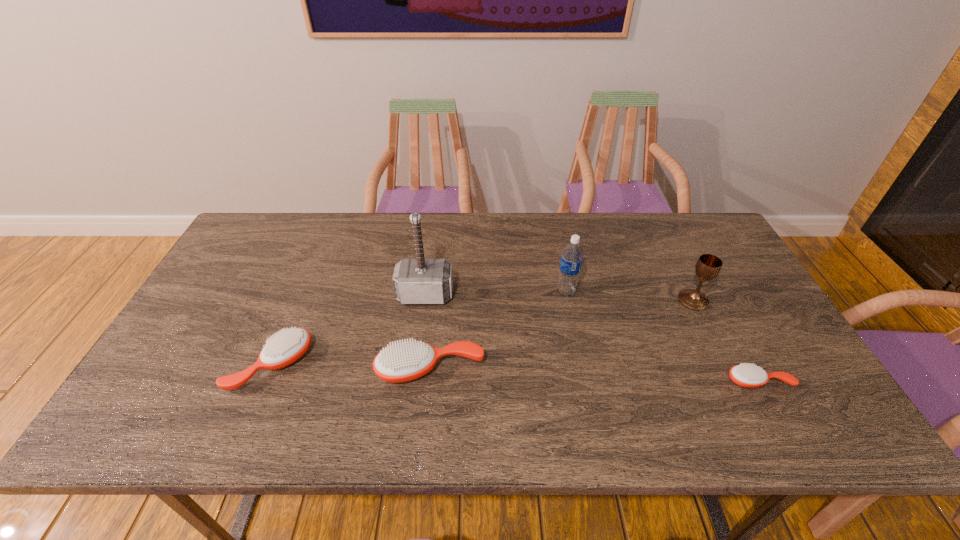
If equal spacing is the goal by inserting an additional hairbrush among them, please point out a vacant space for this new hairbrush. Please provide its 2D coordinates. Your answer should be formatted as a tuple, i.e. [(x, y)], where the tuple contains the x and y coordinates of a point satisfying the conditions above.

[(592, 375)]